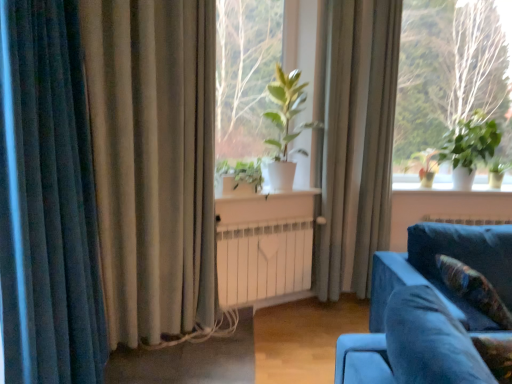
In order to click on free space in front of beige fabric curtain at left, which is counted as the 2th curtain, starting from the front in this screenshot , I will do `click(160, 369)`.